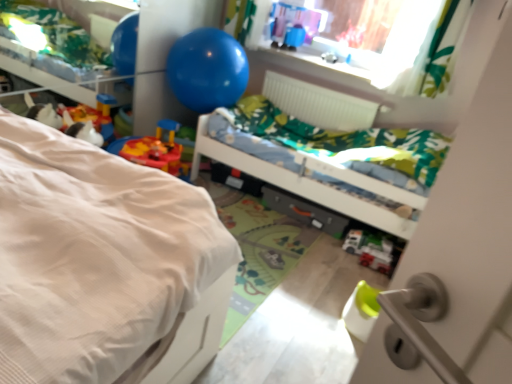
At what (x,y) coordinates should I click in order to perform the action: click on free point above white plastic radiator at upper center (from a real-world perspective). Please return your answer as a coordinate pair (x, y). The height and width of the screenshot is (384, 512). Looking at the image, I should click on (330, 85).